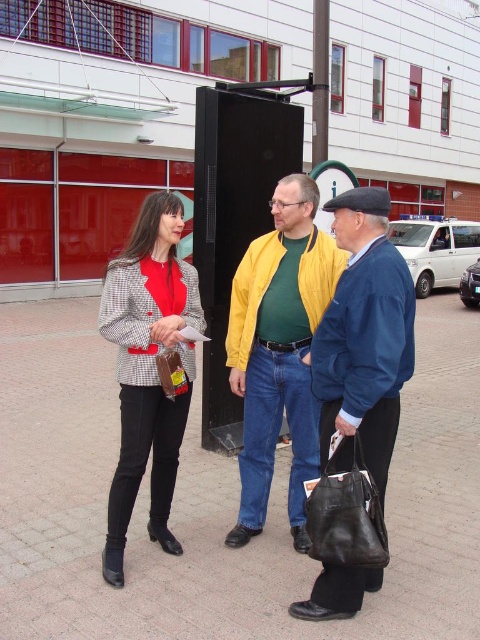
Question: Estimate the real-world distances between objects in this image. Which object is closer to the black plastic pole at center?

Choices:
 (A) black plastic bus stop at center
 (B) matte blue jacket at center
 (C) matte yellow jacket at center
 (D) checkered fabric jacket at left

Answer: (A)

Question: Is matte yellow jacket at center smaller than checkered fabric jacket at left?

Choices:
 (A) no
 (B) yes

Answer: (A)

Question: Which object appears closest to the camera in this image?

Choices:
 (A) black plastic pole at center
 (B) matte yellow jacket at center

Answer: (B)

Question: Among these objects, which one is nearest to the camera?

Choices:
 (A) checkered fabric jacket at left
 (B) matte yellow jacket at center
 (C) black plastic pole at center
 (D) black plastic bus stop at center

Answer: (A)

Question: Is checkered fabric jacket at left further to camera compared to black plastic pole at center?

Choices:
 (A) yes
 (B) no

Answer: (B)

Question: Is matte blue jacket at center above black plastic bus stop at center?

Choices:
 (A) yes
 (B) no

Answer: (B)